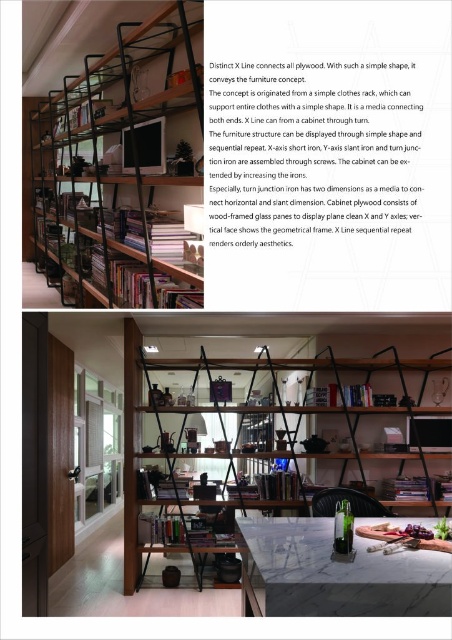
How much distance is there between black matte bookshelf at upper left and matte black shelving unit at center?

The distance of black matte bookshelf at upper left from matte black shelving unit at center is 1.87 meters.

This screenshot has height=640, width=452. What do you see at coordinates (118, 170) in the screenshot?
I see `black matte bookshelf at upper left` at bounding box center [118, 170].

This screenshot has height=640, width=452. In order to click on black matte bookshelf at upper left in this screenshot , I will do `click(118, 170)`.